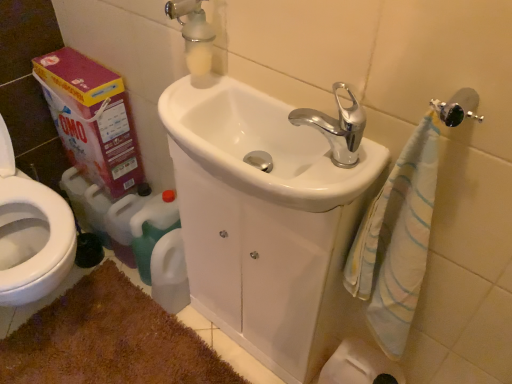
Question: Is matte cardboard box at left inside the boundaries of brown shaggy bath mat at lower left, or outside?

Choices:
 (A) inside
 (B) outside

Answer: (B)

Question: From a real-world perspective, is matte cardboard box at left positioned above or below brown shaggy bath mat at lower left?

Choices:
 (A) above
 (B) below

Answer: (A)

Question: Estimate the real-world distances between objects in this image. Which object is closer to the matte cardboard box at left?

Choices:
 (A) white glossy sink at center
 (B) brown shaggy bath mat at lower left
 (C) white glossy sink at center
 (D) chrome metallic faucet at upper center
 (E) white frosted glass soap dispenser at upper center

Answer: (E)

Question: Which object is positioned farthest from the white glossy sink at center?

Choices:
 (A) chrome metallic faucet at upper center
 (B) matte cardboard box at left
 (C) white glossy sink at center
 (D) white frosted glass soap dispenser at upper center
 (E) brown shaggy bath mat at lower left

Answer: (B)